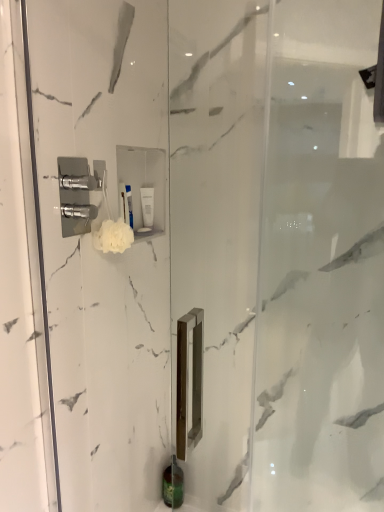
Question: Is green matte bottle at lower center, the 1th toiletry from the right, spatially inside white fluffy sponge at upper center, or outside of it?

Choices:
 (A) outside
 (B) inside

Answer: (A)

Question: Considering the positions of green matte bottle at lower center, the 1th toiletry from the right, and white fluffy sponge at upper center in the image, is green matte bottle at lower center, the 1th toiletry from the right, bigger or smaller than white fluffy sponge at upper center?

Choices:
 (A) big
 (B) small

Answer: (A)

Question: Estimate the real-world distances between objects in this image. Which object is closer to the green matte bottle at lower center, arranged as the second toiletry when viewed from the front?

Choices:
 (A) white matte tube at upper center, which is the second toiletry in back-to-front order
 (B) white fluffy sponge at upper center

Answer: (A)

Question: Based on their relative distances, which object is farther from the white matte tube at upper center, placed as the 1th toiletry when sorted from top to bottom?

Choices:
 (A) green matte bottle at lower center, which appears as the 2th toiletry when viewed from the top
 (B) white fluffy sponge at upper center

Answer: (A)